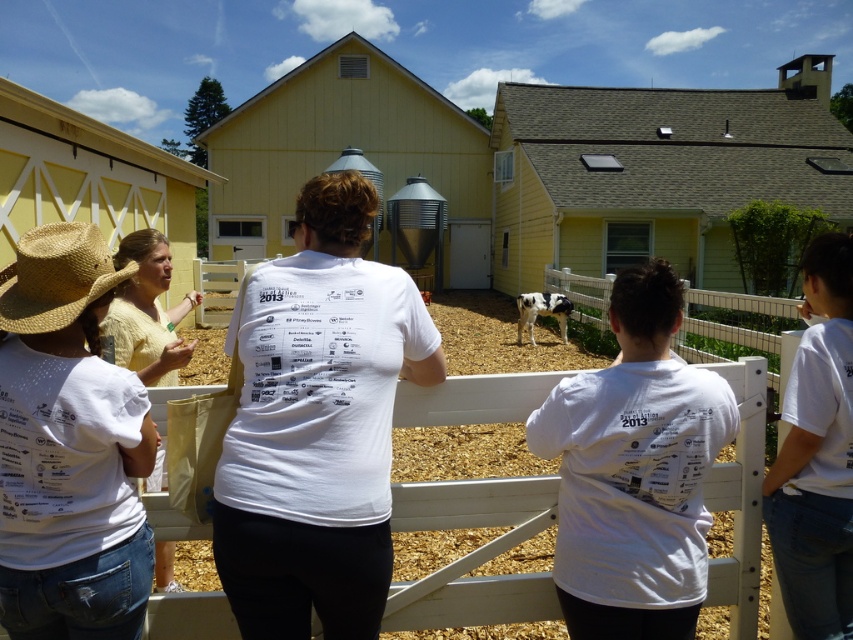
Question: Is white matte t-shirt at center wider than white matte shirt at center?

Choices:
 (A) yes
 (B) no

Answer: (B)

Question: Based on their relative distances, which object is nearer to the white matte t-shirt at center?

Choices:
 (A) yellow painted barn at center
 (B) black and white spotted calf at center
 (C) yellow siding at upper center
 (D) white matte shirt at center

Answer: (D)

Question: Which point appears farthest from the camera in this image?

Choices:
 (A) (138, 364)
 (B) (440, 176)

Answer: (B)

Question: Does white matte shirt at center appear under natural straw cowboy hat at left?

Choices:
 (A) no
 (B) yes

Answer: (B)

Question: Which point is closer to the camera?

Choices:
 (A) black and white spotted calf at center
 (B) yellow cotton shirt at center

Answer: (B)

Question: Can you confirm if white cotton shirt at center is smaller than black and white spotted calf at center?

Choices:
 (A) yes
 (B) no

Answer: (A)